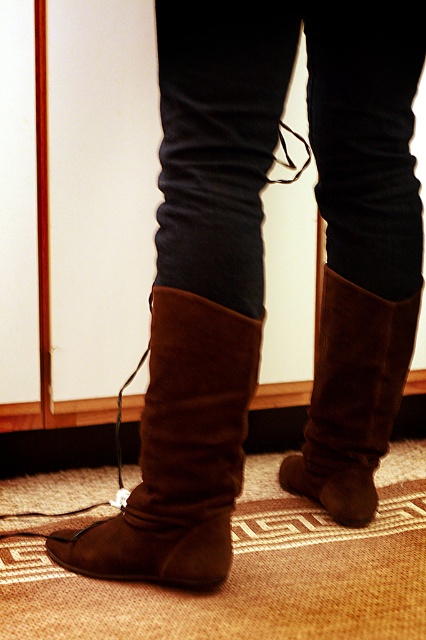
Question: Is suede boot at lower left to the right of brown suede boot at lower center from the viewer's perspective?

Choices:
 (A) yes
 (B) no

Answer: (B)

Question: Is suede boot at lower left positioned behind brown suede boot at lower center?

Choices:
 (A) yes
 (B) no

Answer: (B)

Question: Which object appears farthest from the camera in this image?

Choices:
 (A) suede boot at lower left
 (B) brown suede boot at lower center

Answer: (B)

Question: Can you confirm if suede boot at lower left is thinner than brown suede boot at lower center?

Choices:
 (A) no
 (B) yes

Answer: (A)